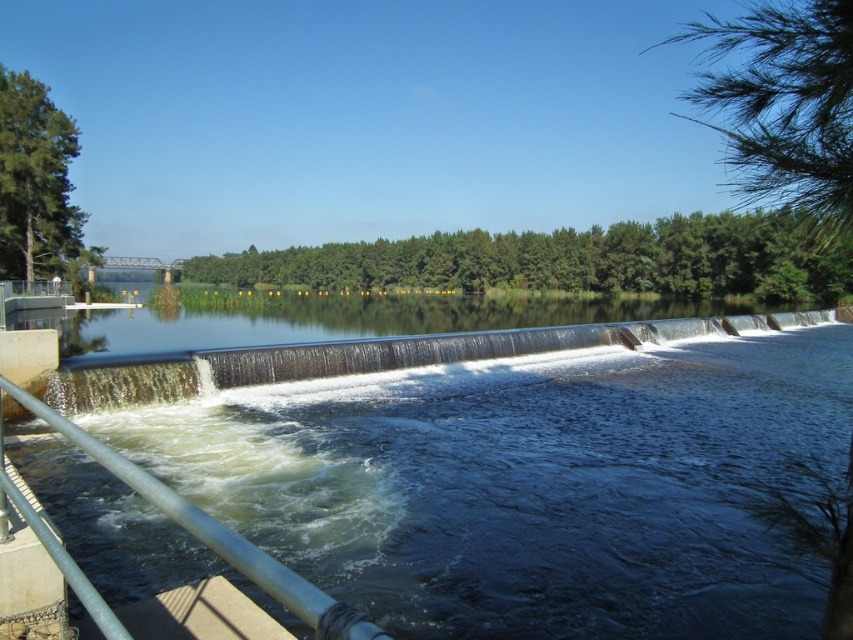
Does dark blue water at center have a greater height compared to metal/rustic rail at lower left?

Correct, dark blue water at center is much taller as metal/rustic rail at lower left.

Can you confirm if dark blue water at center is wider than metal/rustic rail at lower left?

Yes, dark blue water at center is wider than metal/rustic rail at lower left.

This screenshot has width=853, height=640. I want to click on dark blue water at center, so click(x=509, y=477).